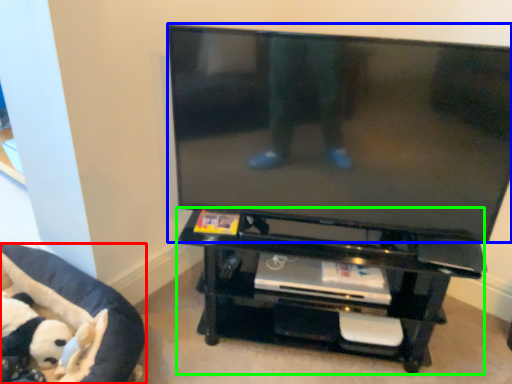
Question: Which is nearer to the furniture (highlighted by a red box)? television (highlighted by a blue box) or entertainment center (highlighted by a green box).

Choices:
 (A) television
 (B) entertainment center

Answer: (B)